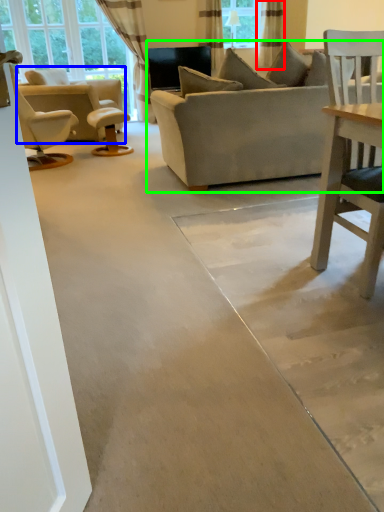
Question: Which is nearer to the curtain (highlighted by a red box)? chair (highlighted by a blue box) or studio couch (highlighted by a green box).

Choices:
 (A) chair
 (B) studio couch

Answer: (A)